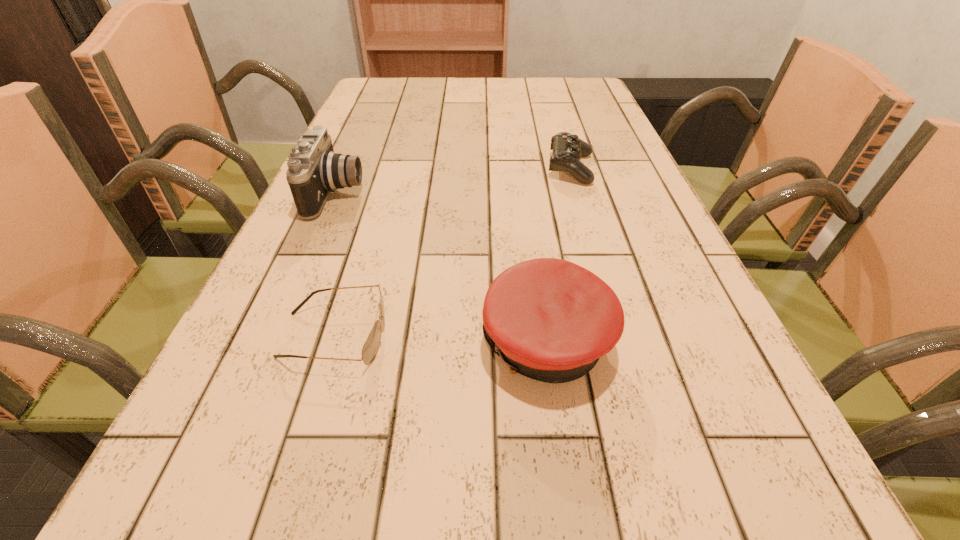
Where is `empty space that is in between the cap and the control`? This screenshot has width=960, height=540. empty space that is in between the cap and the control is located at coordinates click(x=559, y=256).

You are a GUI agent. You are given a task and a screenshot of the screen. Output one action in this format:
    pyautogui.click(x=<x>, y=<y>)
    Task: Click on the vacant region between the tallest object and the shortest object
    
    Given the screenshot: What is the action you would take?
    pyautogui.click(x=335, y=265)

This screenshot has width=960, height=540. I want to click on vacant space in between the cap and the tallest object, so click(x=442, y=269).

I want to click on free space between the sunglasses and the camera, so click(335, 265).

You are a GUI agent. You are given a task and a screenshot of the screen. Output one action in this format:
    pyautogui.click(x=<x>, y=<y>)
    Task: Click on the empty location between the third shortest object and the camera
    The width and height of the screenshot is (960, 540).
    Given the screenshot: What is the action you would take?
    pyautogui.click(x=442, y=269)

Find the location of `blank region between the tallest object and the sunglasses`. blank region between the tallest object and the sunglasses is located at coordinates (335, 265).

Where is `empty space that is in between the second tallest object and the control`? This screenshot has width=960, height=540. empty space that is in between the second tallest object and the control is located at coordinates (559, 256).

Where is `free space that is in between the control and the tallest object`? Image resolution: width=960 pixels, height=540 pixels. free space that is in between the control and the tallest object is located at coordinates (454, 181).

Locate which object is the closest to the cap. Please provide its 2D coordinates. Your answer should be formatted as a tuple, i.e. [(x, y)], where the tuple contains the x and y coordinates of a point satisfying the conditions above.

[(370, 348)]

What are the coordinates of `object that is the third closest to the control` in the screenshot? It's located at (370, 348).